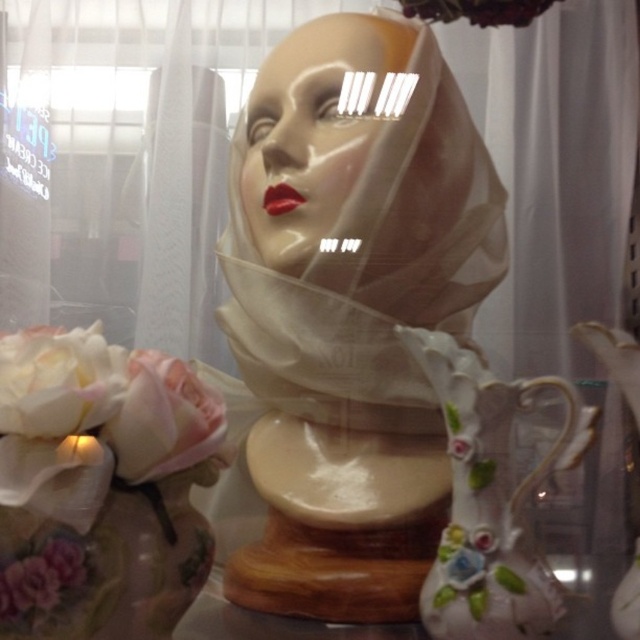
You are an interior designer arranging flowers for a display. You have a white silk flower at lower left and a pink fabric flower at lower left. Which flower should you place closer to the viewer to maintain the current arrangement?

The white silk flower at lower left should be placed closer to the viewer since it is in front of the pink fabric flower at lower left in the current arrangement.